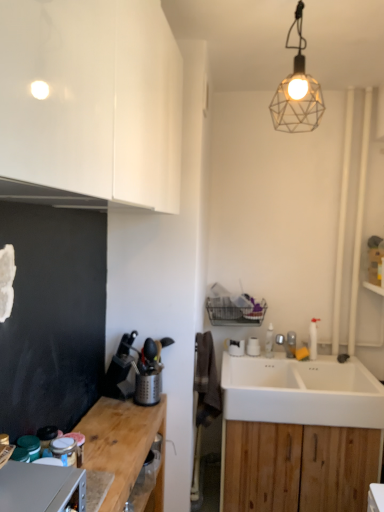
Question: Is the position of glossy white cabinet at upper left, the second cabinetry positioned from the right, more distant than that of metallic grater at left, the first appliance from the back?

Choices:
 (A) no
 (B) yes

Answer: (A)

Question: Is glossy white cabinet at upper left, which is the 1th cabinetry in top-to-bottom order, shorter than metallic grater at left, the first appliance from the back?

Choices:
 (A) yes
 (B) no

Answer: (B)

Question: From a real-world perspective, is glossy white cabinet at upper left, which is the 1th cabinetry in top-to-bottom order, on top of metallic grater at left, which appears as the third appliance when viewed from the front?

Choices:
 (A) yes
 (B) no

Answer: (A)

Question: Is glossy white cabinet at upper left, the first cabinetry from the front, outside of metallic grater at left, the first appliance from the back?

Choices:
 (A) no
 (B) yes

Answer: (B)

Question: Can you confirm if glossy white cabinet at upper left, the second cabinetry positioned from the right, is bigger than metallic grater at left, which appears as the third appliance when viewed from the front?

Choices:
 (A) yes
 (B) no

Answer: (A)

Question: Based on their positions, is matte glass jar at lower left, which ranks as the 2th appliance in back-to-front order, located to the left or right of wooden at left?

Choices:
 (A) right
 (B) left

Answer: (B)

Question: From a real-world perspective, is matte glass jar at lower left, positioned as the 2th appliance in front-to-back order, above or below wooden at left?

Choices:
 (A) above
 (B) below

Answer: (A)

Question: Is matte glass jar at lower left, which ranks as the 2th appliance in back-to-front order, wider or thinner than wooden at left?

Choices:
 (A) thin
 (B) wide

Answer: (A)

Question: Is matte glass jar at lower left, which ranks as the 2th appliance in back-to-front order, in front of or behind wooden at left in the image?

Choices:
 (A) behind
 (B) front

Answer: (A)

Question: Considering the positions of white ceramic sink at lower right and white wood cabinet at lower right, which is counted as the 1th cabinetry, starting from the bottom, in the image, is white ceramic sink at lower right bigger or smaller than white wood cabinet at lower right, which is counted as the 1th cabinetry, starting from the bottom,?

Choices:
 (A) small
 (B) big

Answer: (A)

Question: Which is correct: white ceramic sink at lower right is inside white wood cabinet at lower right, which is the second cabinetry from top to bottom, or outside of it?

Choices:
 (A) outside
 (B) inside

Answer: (B)

Question: Relative to white wood cabinet at lower right, positioned as the 2th cabinetry in front-to-back order, is white ceramic sink at lower right in front or behind?

Choices:
 (A) front
 (B) behind

Answer: (A)

Question: From the image's perspective, is white ceramic sink at lower right above or below white wood cabinet at lower right, which appears as the 1th cabinetry when viewed from the right?

Choices:
 (A) below
 (B) above

Answer: (B)

Question: From the image's perspective, relative to satin silver metallic fridge at lower left, which is the 1th appliance in front-to-back order, is white wood cabinet at lower right, positioned as the 2th cabinetry in front-to-back order, above or below?

Choices:
 (A) above
 (B) below

Answer: (B)

Question: Is white wood cabinet at lower right, positioned as the 1th cabinetry in back-to-front order, in front of or behind satin silver metallic fridge at lower left, which appears as the third appliance when viewed from the back, in the image?

Choices:
 (A) front
 (B) behind

Answer: (B)